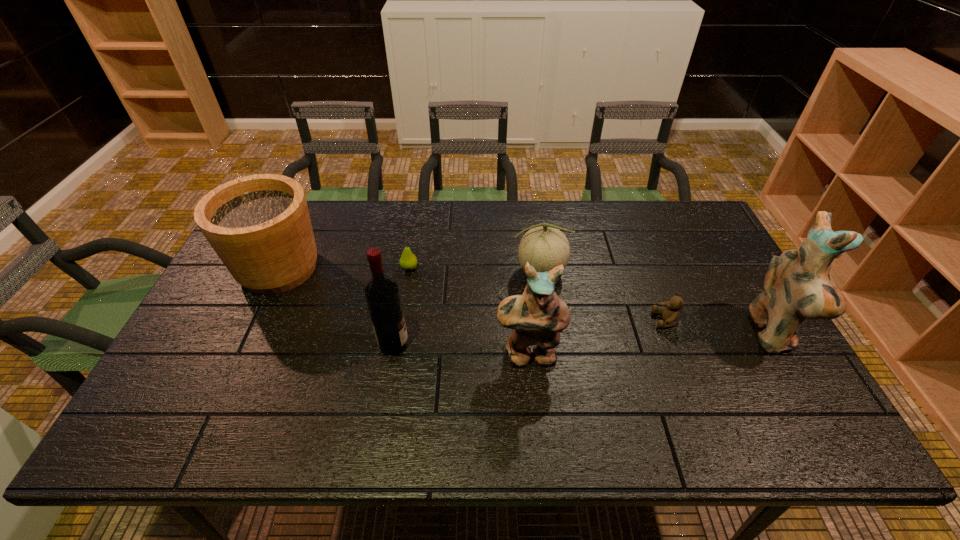
What are the coordinates of `object situated at the far left corner` in the screenshot? It's located at (259, 225).

Where is `vacant space at the far edge`? The height and width of the screenshot is (540, 960). vacant space at the far edge is located at coordinates pyautogui.click(x=605, y=238).

In the image, there is a desktop. Identify the location of vacant space at the near edge. (578, 397).

In the image, there is a desktop. Where is `vacant space at the left edge`? Image resolution: width=960 pixels, height=540 pixels. vacant space at the left edge is located at coordinates (221, 300).

The image size is (960, 540). What are the coordinates of `free point at the right edge` in the screenshot? It's located at (686, 266).

You are a GUI agent. You are given a task and a screenshot of the screen. Output one action in this format:
    pyautogui.click(x=<x>, y=<y>)
    Task: Click on the free region at the far right corner of the desktop
    This screenshot has width=960, height=540.
    Given the screenshot: What is the action you would take?
    pyautogui.click(x=684, y=239)

Locate an element on the screen. This screenshot has width=960, height=540. free space between the shorter figurine and the alcohol is located at coordinates (461, 349).

Image resolution: width=960 pixels, height=540 pixels. In order to click on empty space between the cantaloup and the second object from right to left in this screenshot , I will do `click(602, 296)`.

Locate an element on the screen. The image size is (960, 540). empty space that is in between the second object from right to left and the flowerpot is located at coordinates (472, 294).

Find the location of a particular element. Image resolution: width=960 pixels, height=540 pixels. unoccupied position between the right figurine and the sixth object from left to right is located at coordinates (718, 327).